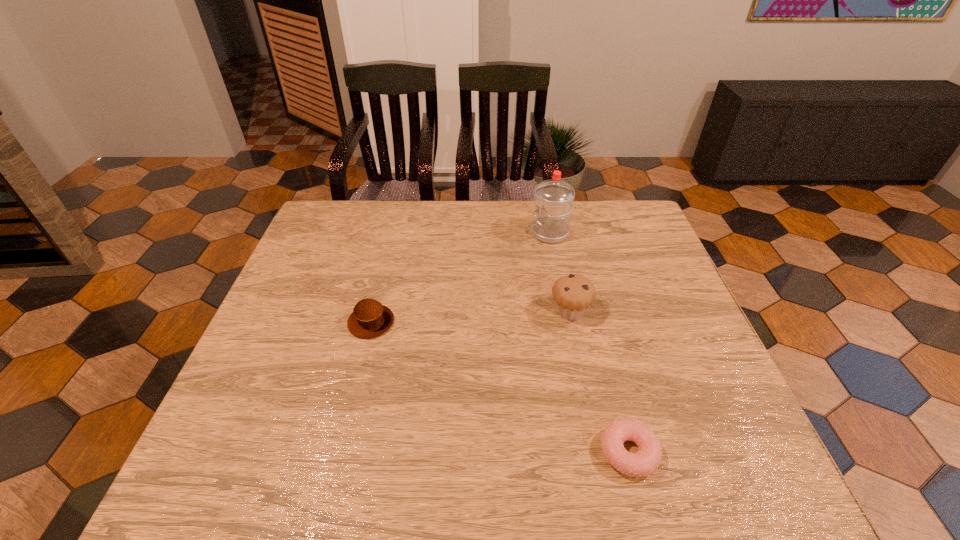
In order to click on free location located on the handle side of the tallest object in this screenshot , I will do `click(431, 233)`.

I want to click on vacant space located on the front of the second tallest object, so click(589, 402).

You are a GUI agent. You are given a task and a screenshot of the screen. Output one action in this format:
    pyautogui.click(x=<x>, y=<y>)
    Task: Click on the free space located on the front of the left muffin
    Image resolution: width=960 pixels, height=540 pixels.
    Given the screenshot: What is the action you would take?
    pyautogui.click(x=354, y=390)

Image resolution: width=960 pixels, height=540 pixels. Identify the location of vacant space located on the back of the nearest object. (613, 392).

Where is `object that is positioned at the far edge`? object that is positioned at the far edge is located at coordinates (554, 197).

Find the location of a particular element. object situated at the near edge is located at coordinates (646, 461).

The height and width of the screenshot is (540, 960). Find the location of `free region at the far edge`. free region at the far edge is located at coordinates (514, 232).

Locate an element on the screen. vacant region at the near edge of the desktop is located at coordinates (560, 449).

Locate an element on the screen. free space at the left edge of the desktop is located at coordinates (245, 403).

The width and height of the screenshot is (960, 540). I want to click on vacant space at the right edge, so click(x=682, y=357).